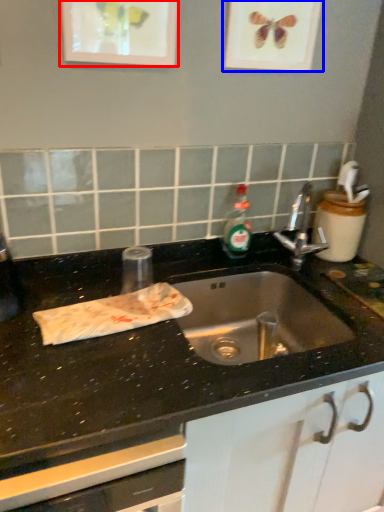
Question: Among these objects, which one is nearest to the camera, picture frame (highlighted by a red box) or picture frame (highlighted by a blue box)?

Choices:
 (A) picture frame
 (B) picture frame

Answer: (A)